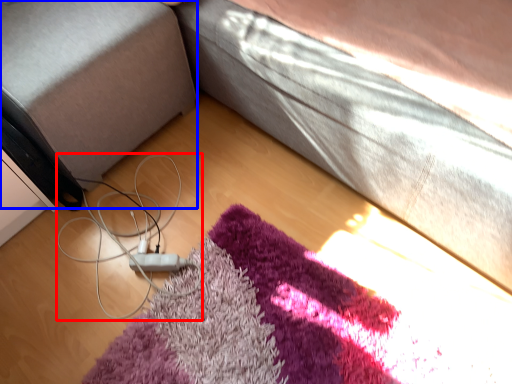
Question: Among these objects, which one is nearest to the camera, cable (highlighted by a red box) or gray (highlighted by a blue box)?

Choices:
 (A) cable
 (B) gray

Answer: (B)